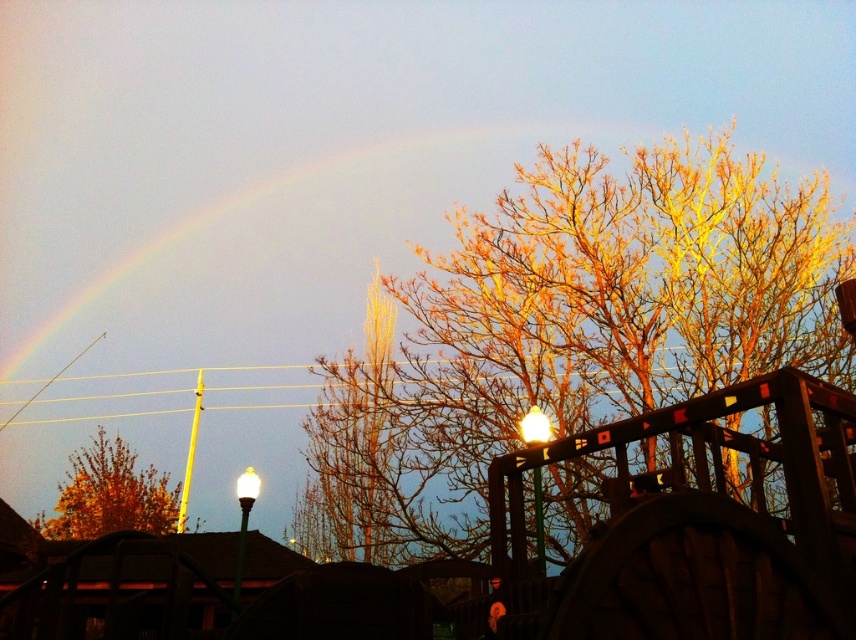
Based on the photo, you are standing in the park and see the rainbow at upper left and the golden leafy tree at lower left. Which object is located to the right of the other?

A: The rainbow at upper left is positioned on the right side of golden leafy tree at lower left.